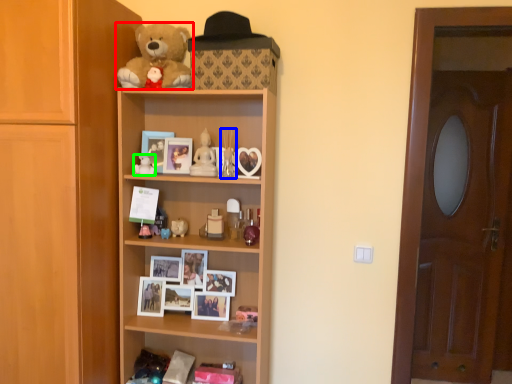
Question: Which object is the farthest from teddy bear (highlighted by a red box)? Choose among these: toy (highlighted by a blue box) or toy (highlighted by a green box).

Choices:
 (A) toy
 (B) toy

Answer: (B)